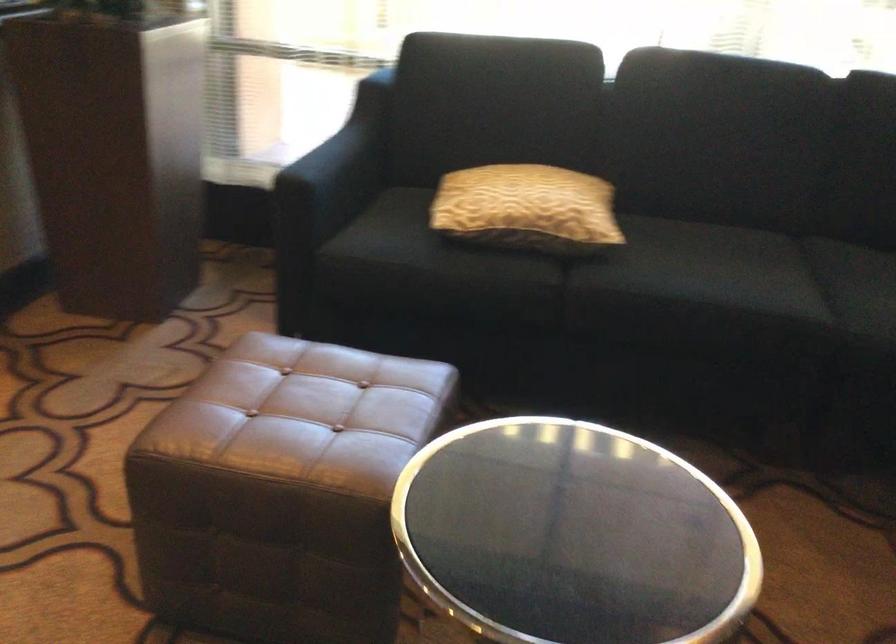
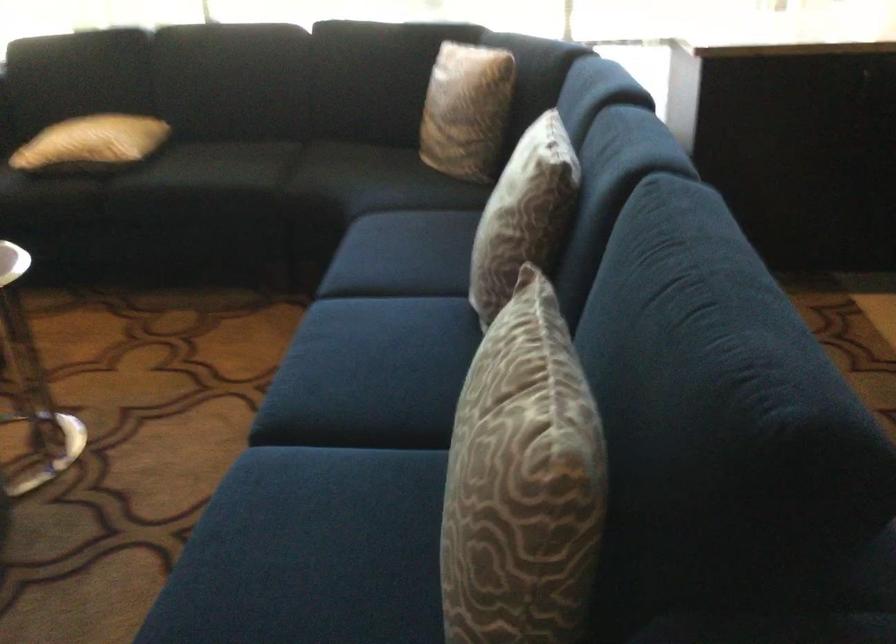
Locate, in the second image, the point that corresponds to pixel 556 213 in the first image.

(91, 142)